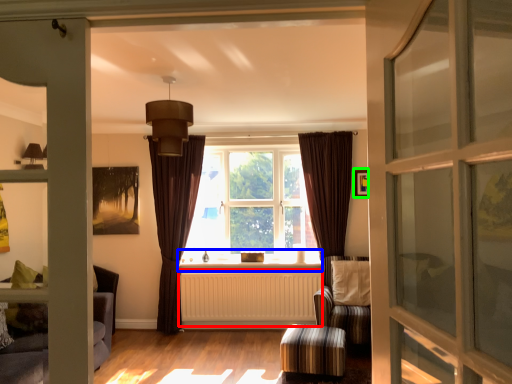
Question: Based on their relative distances, which object is nearer to radiator (highlighted by a red box)? Choose from window sill (highlighted by a blue box) and picture frame (highlighted by a green box).

Choices:
 (A) window sill
 (B) picture frame

Answer: (A)